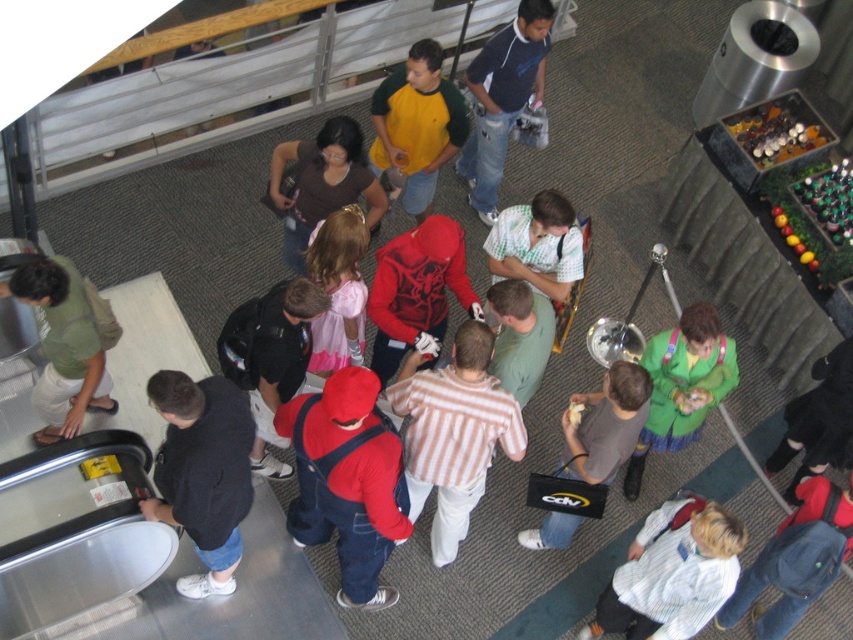
You are a photographer at the event and want to capture both the dark blue denim jeans at lower left and the light blue sweater at center in a single frame. Since you need to ensure both are clearly visible, which object should you focus on first to maintain sharpness?

The dark blue denim jeans at lower left should be focused on first because it has a larger size compared to the light blue sweater at center, ensuring it remains sharp while the smaller object may still be in focus depending on the camera settings.

You are a photographer at the event and want to capture a photo that includes both the dark blue denim jeans at lower left and the green cotton shirt at left. What is the minimum distance you need to maintain between the camera and these two objects to ensure they are both in frame?

The dark blue denim jeans at lower left is 3.33 feet away from the green cotton shirt at left. To ensure both are in frame, the photographer should position the camera at least 3.33 feet away from the nearest object, which is the dark blue denim jeans at lower left, so that the total distance between them accommodates both in the shot.